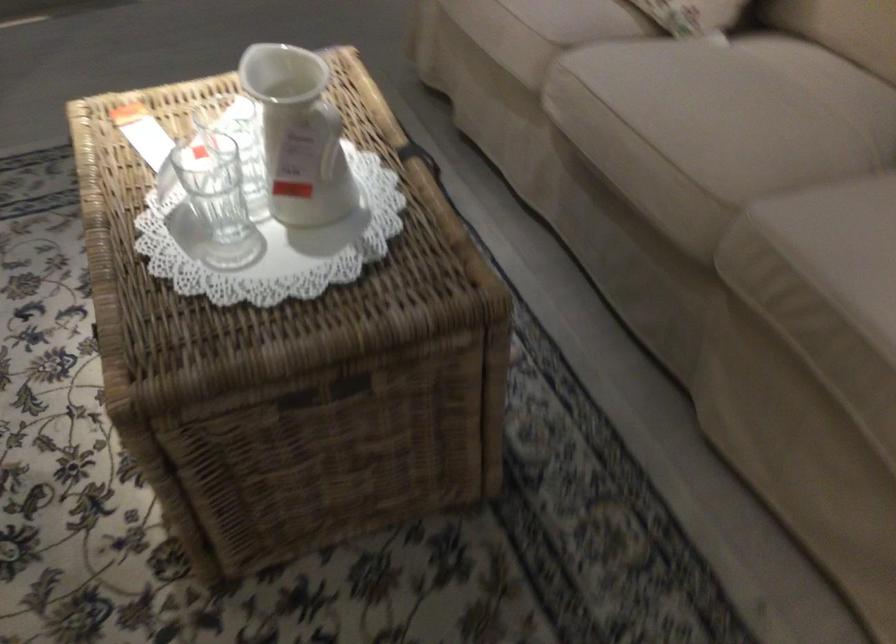
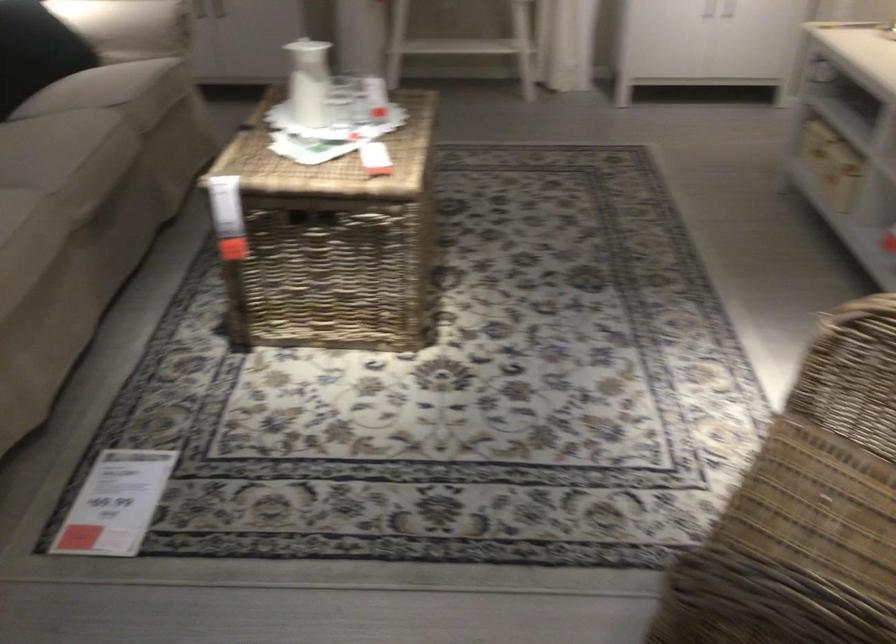
In the second image, find the point that corresponds to pixel 302 131 in the first image.

(308, 82)